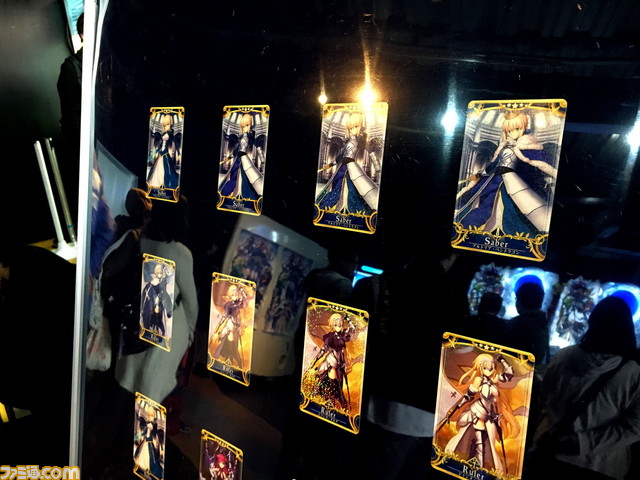
Locate an element on the screen. Image resolution: width=640 pixels, height=480 pixels. playing cards is located at coordinates (518, 167), (342, 171), (228, 177), (159, 161), (146, 310), (228, 319), (333, 351), (473, 379), (223, 473), (148, 440).